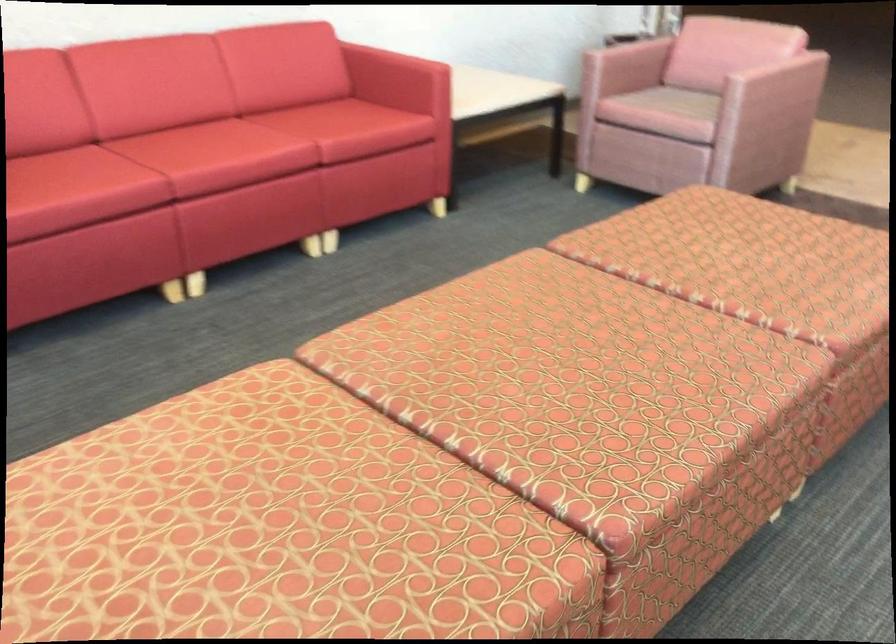
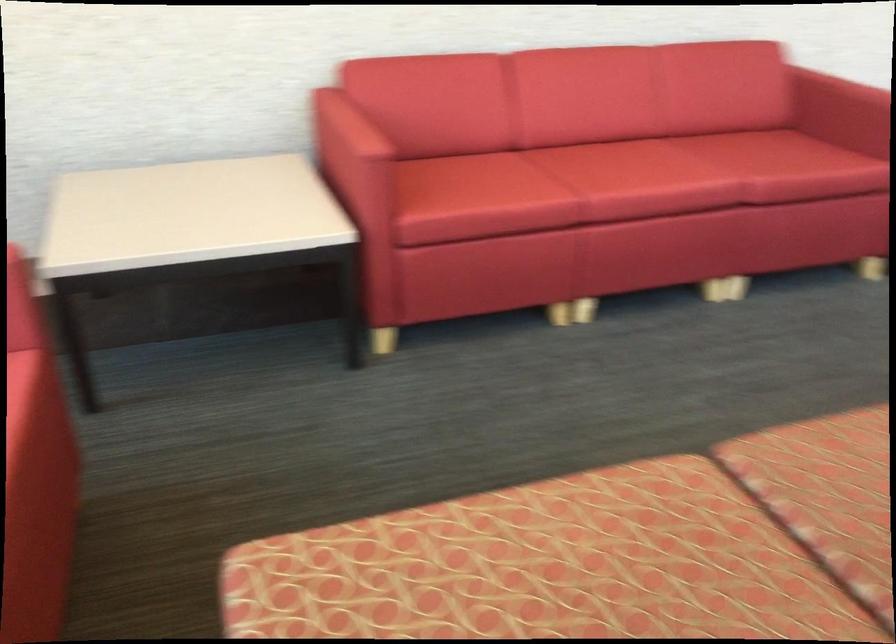
Question: The first image is from the beginning of the video and the second image is from the end. How did the camera likely rotate when shooting the video?

Choices:
 (A) Left
 (B) Right
 (C) Up
 (D) Down

Answer: (A)